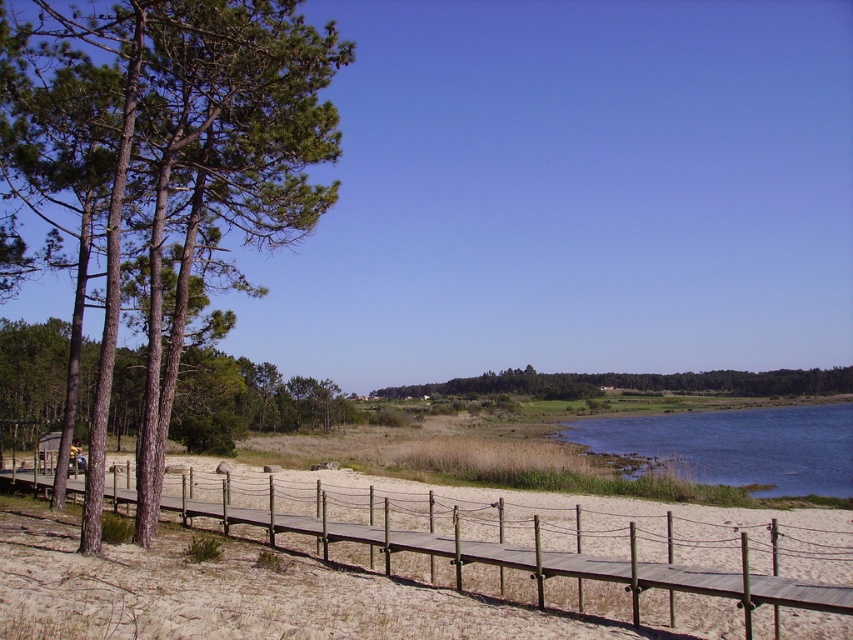
Is brown rough tree at left thinner than green leafy tree at center?

Indeed, brown rough tree at left has a lesser width compared to green leafy tree at center.

Is point (242, 276) positioned in front of point (672, 378)?

Yes.

Which is behind, point (218, 285) or point (795, 394)?

The point (795, 394) is behind.

The image size is (853, 640). Find the location of `brown rough tree at left`. brown rough tree at left is located at coordinates (189, 164).

Does blue water at lower right have a larger size compared to green leafy tree at center?

Correct, blue water at lower right is larger in size than green leafy tree at center.

Is point (805, 460) positioned in front of point (816, 392)?

Yes, it is in front of point (816, 392).

Identify the location of blue water at lower right. The width and height of the screenshot is (853, 640). (738, 445).

Does brown rough tree at left lie behind blue water at lower right?

That is False.

Which is in front, point (170, 419) or point (724, 420)?

Point (170, 419)

Describe the element at coordinates (189, 164) in the screenshot. I see `brown rough tree at left` at that location.

You are a GUI agent. You are given a task and a screenshot of the screen. Output one action in this format:
    pyautogui.click(x=<x>, y=<y>)
    Task: Click on the brown rough tree at left
    
    Given the screenshot: What is the action you would take?
    pyautogui.click(x=189, y=164)